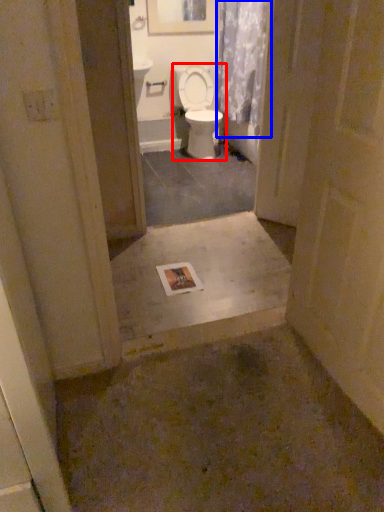
Question: Among these objects, which one is farthest to the camera, toilet (highlighted by a red box) or shower curtain (highlighted by a blue box)?

Choices:
 (A) toilet
 (B) shower curtain

Answer: (A)